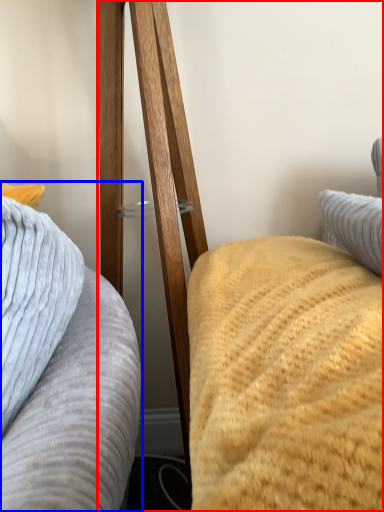
Question: Among these objects, which one is nearest to the camera, furniture (highlighted by a red box) or furniture (highlighted by a blue box)?

Choices:
 (A) furniture
 (B) furniture

Answer: (A)